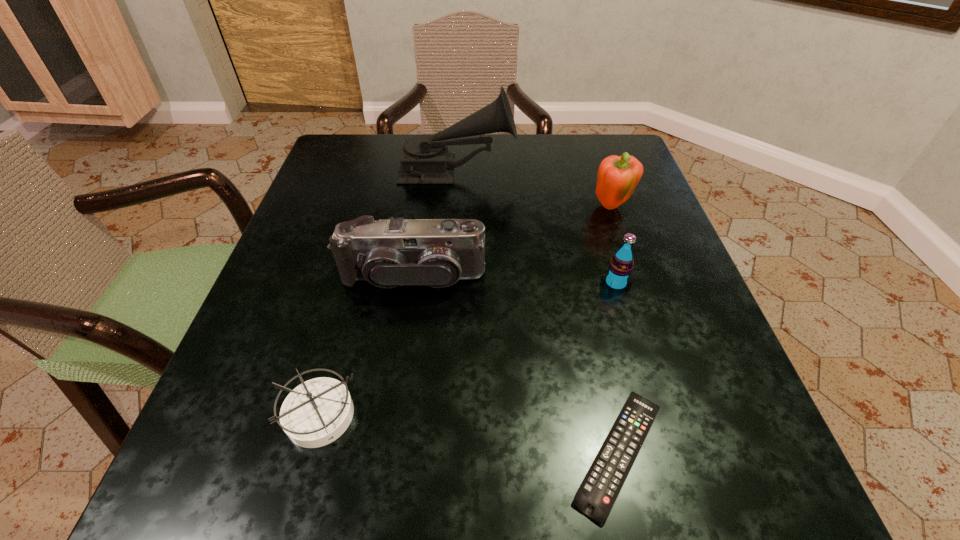
Where is `free space that satisfies the following two spatial constraints: 1. on the front-facing side of the camcorder; 2. on the right side of the remote control`? This screenshot has width=960, height=540. free space that satisfies the following two spatial constraints: 1. on the front-facing side of the camcorder; 2. on the right side of the remote control is located at coordinates (388, 453).

What are the coordinates of `vacant space that satisfies the following two spatial constraints: 1. on the back side of the fifth nearest object; 2. from the horn of the phonograph_record` in the screenshot? It's located at (600, 172).

You are a GUI agent. You are given a task and a screenshot of the screen. Output one action in this format:
    pyautogui.click(x=<x>, y=<y>)
    Task: Click on the free point that satisfies the following two spatial constraints: 1. from the horn of the farthest object; 2. on the right side of the soda
    
    Given the screenshot: What is the action you would take?
    pyautogui.click(x=449, y=284)

The height and width of the screenshot is (540, 960). In order to click on vacant region that satisfies the following two spatial constraints: 1. from the horn of the phonograph_record; 2. on the back side of the pepper in this screenshot , I will do `click(455, 208)`.

Find the location of a particular element. This screenshot has height=540, width=960. blank area in the image that satisfies the following two spatial constraints: 1. from the horn of the soda; 2. on the left side of the phonograph_record is located at coordinates (449, 284).